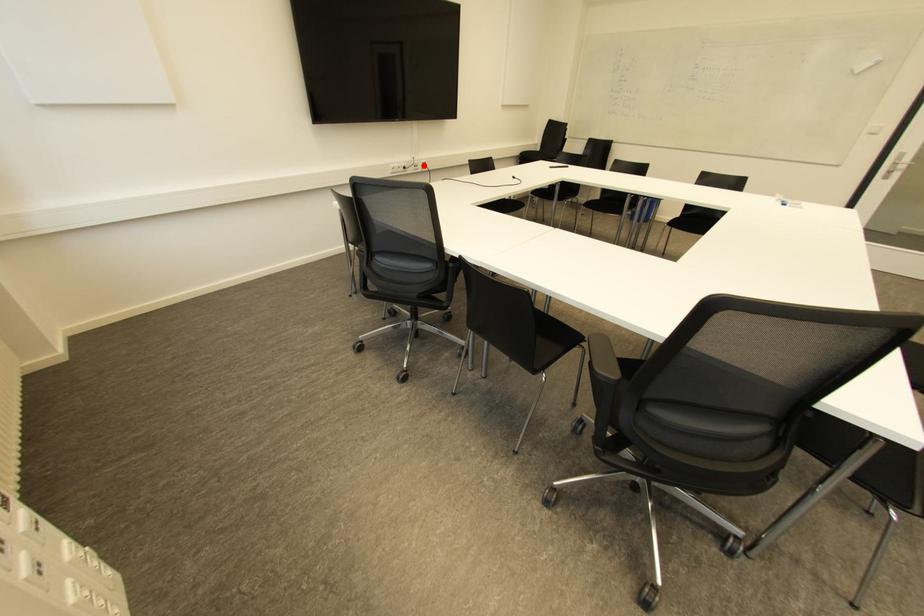
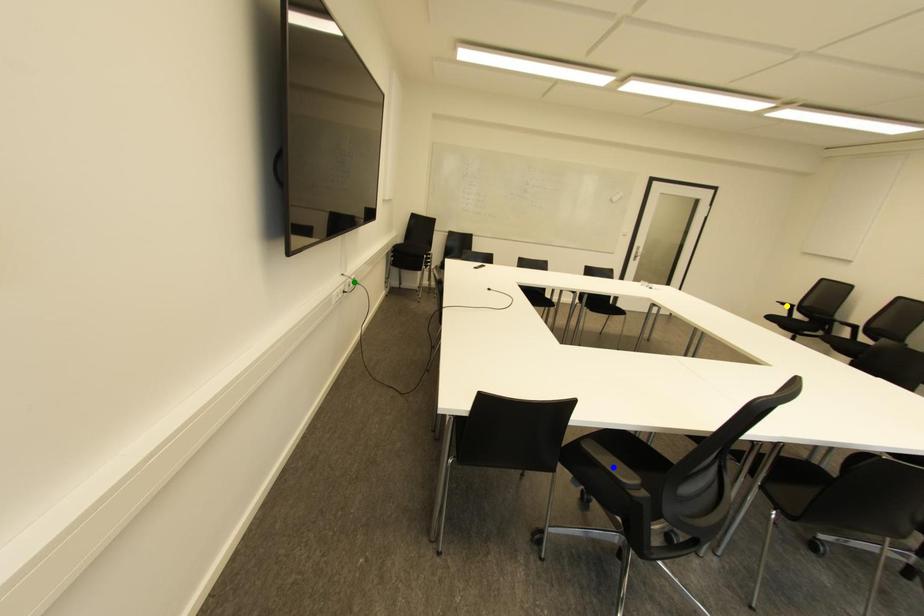
Question: I am providing you with two images of the same scene from different viewpoints. A red point is marked on the first image. You are given multiple points on the second image. Which point in image 2 represents the same 3d spot as the red point in image 1?

Choices:
 (A) blue point
 (B) green point
 (C) yellow point

Answer: (B)